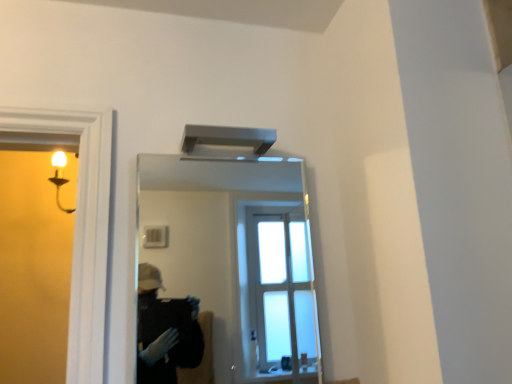
What do you see at coordinates (228, 137) in the screenshot? The width and height of the screenshot is (512, 384). I see `satin silver exhaust hood at upper center` at bounding box center [228, 137].

At what (x,y) coordinates should I click in order to perform the action: click on satin silver exhaust hood at upper center. Please return your answer as a coordinate pair (x, y). Looking at the image, I should click on (228, 137).

Identify the location of clear glass mirror at upper center. (238, 256).

What do you see at coordinates (238, 256) in the screenshot? I see `clear glass mirror at upper center` at bounding box center [238, 256].

Image resolution: width=512 pixels, height=384 pixels. Find the location of `satin silver exhaust hood at upper center`. satin silver exhaust hood at upper center is located at coordinates (228, 137).

Is satin silver exhaust hood at upper center to the left or to the right of clear glass mirror at upper center in the image?

satin silver exhaust hood at upper center is positioned on clear glass mirror at upper center's left side.

Does satin silver exhaust hood at upper center come behind clear glass mirror at upper center?

That is True.

Is point (252, 144) closer or farther from the camera than point (259, 248)?

Point (252, 144) is positioned closer to the camera compared to point (259, 248).

From the image's perspective, is satin silver exhaust hood at upper center beneath clear glass mirror at upper center?

Actually, satin silver exhaust hood at upper center appears above clear glass mirror at upper center in the image.

From a real-world perspective, between satin silver exhaust hood at upper center and clear glass mirror at upper center, who is vertically lower?

From a 3D spatial view, clear glass mirror at upper center is below.

Between satin silver exhaust hood at upper center and clear glass mirror at upper center, which one has larger width?

Wider between the two is satin silver exhaust hood at upper center.

Considering the relative sizes of satin silver exhaust hood at upper center and clear glass mirror at upper center in the image provided, is satin silver exhaust hood at upper center taller than clear glass mirror at upper center?

In fact, satin silver exhaust hood at upper center may be shorter than clear glass mirror at upper center.

Considering the relative sizes of satin silver exhaust hood at upper center and clear glass mirror at upper center in the image provided, is satin silver exhaust hood at upper center bigger than clear glass mirror at upper center?

No.

Could clear glass mirror at upper center be considered to be inside satin silver exhaust hood at upper center?

That's incorrect, clear glass mirror at upper center is not inside satin silver exhaust hood at upper center.

Can you see satin silver exhaust hood at upper center touching clear glass mirror at upper center?

They are not placed beside each other.

Is satin silver exhaust hood at upper center aimed at clear glass mirror at upper center?

No, satin silver exhaust hood at upper center is not turned towards clear glass mirror at upper center.

How different are the orientations of satin silver exhaust hood at upper center and clear glass mirror at upper center in degrees?

The angular difference between satin silver exhaust hood at upper center and clear glass mirror at upper center is 0.313 degrees.

How distant is satin silver exhaust hood at upper center from clear glass mirror at upper center?

A distance of 1.90 meters exists between satin silver exhaust hood at upper center and clear glass mirror at upper center.

Find the location of a particular element. mirror that appears on the right of satin silver exhaust hood at upper center is located at coordinates (238, 256).

Based on their positions, is clear glass mirror at upper center located to the left or right of satin silver exhaust hood at upper center?

From the image, it's evident that clear glass mirror at upper center is to the right of satin silver exhaust hood at upper center.

Is the depth of clear glass mirror at upper center less than that of satin silver exhaust hood at upper center?

Yes, clear glass mirror at upper center is closer to the camera.

Is point (287, 249) in front of point (251, 143)?

No, it is behind (251, 143).

From the image's perspective, does clear glass mirror at upper center appear lower than satin silver exhaust hood at upper center?

Indeed, from the image's perspective, clear glass mirror at upper center is shown beneath satin silver exhaust hood at upper center.

From a real-world perspective, is clear glass mirror at upper center under satin silver exhaust hood at upper center?

Yes, from a real-world perspective, clear glass mirror at upper center is beneath satin silver exhaust hood at upper center.

Considering the relative sizes of clear glass mirror at upper center and satin silver exhaust hood at upper center in the image provided, is clear glass mirror at upper center thinner than satin silver exhaust hood at upper center?

Correct, the width of clear glass mirror at upper center is less than that of satin silver exhaust hood at upper center.

Is clear glass mirror at upper center taller or shorter than satin silver exhaust hood at upper center?

In the image, clear glass mirror at upper center appears to be taller than satin silver exhaust hood at upper center.

Does clear glass mirror at upper center have a larger size compared to satin silver exhaust hood at upper center?

Yes.

Is satin silver exhaust hood at upper center completely or partially inside clear glass mirror at upper center?

That's incorrect, satin silver exhaust hood at upper center is not inside clear glass mirror at upper center.

Is clear glass mirror at upper center far from satin silver exhaust hood at upper center?

Indeed, clear glass mirror at upper center is not near satin silver exhaust hood at upper center.

Could you tell me if clear glass mirror at upper center is facing satin silver exhaust hood at upper center?

Yes, clear glass mirror at upper center faces towards satin silver exhaust hood at upper center.

How much distance is there between clear glass mirror at upper center and satin silver exhaust hood at upper center?

clear glass mirror at upper center and satin silver exhaust hood at upper center are 1.90 meters apart from each other.

At what (x,y) coordinates should I click in order to perform the action: click on exhaust hood above the clear glass mirror at upper center (from a real-world perspective). Please return your answer as a coordinate pair (x, y). Looking at the image, I should click on (228, 137).

Locate an element on the screen. The width and height of the screenshot is (512, 384). exhaust hood above the clear glass mirror at upper center (from a real-world perspective) is located at coordinates (228, 137).

In the image, there is a clear glass mirror at upper center. Where is `exhaust hood above it (from the image's perspective)`? This screenshot has width=512, height=384. exhaust hood above it (from the image's perspective) is located at coordinates (228, 137).